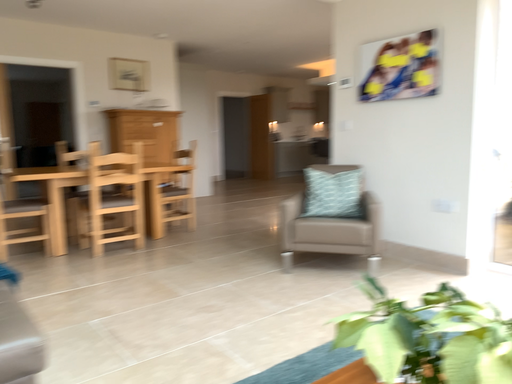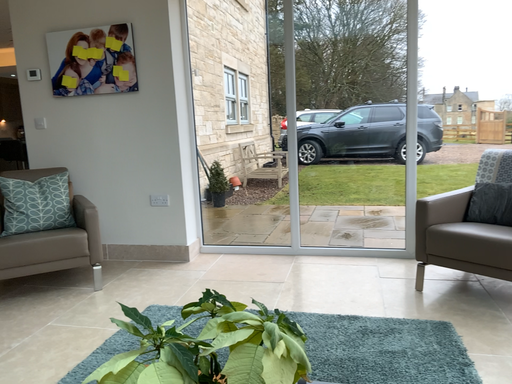
Question: Which way did the camera rotate in the video?

Choices:
 (A) rotated left
 (B) rotated right

Answer: (B)